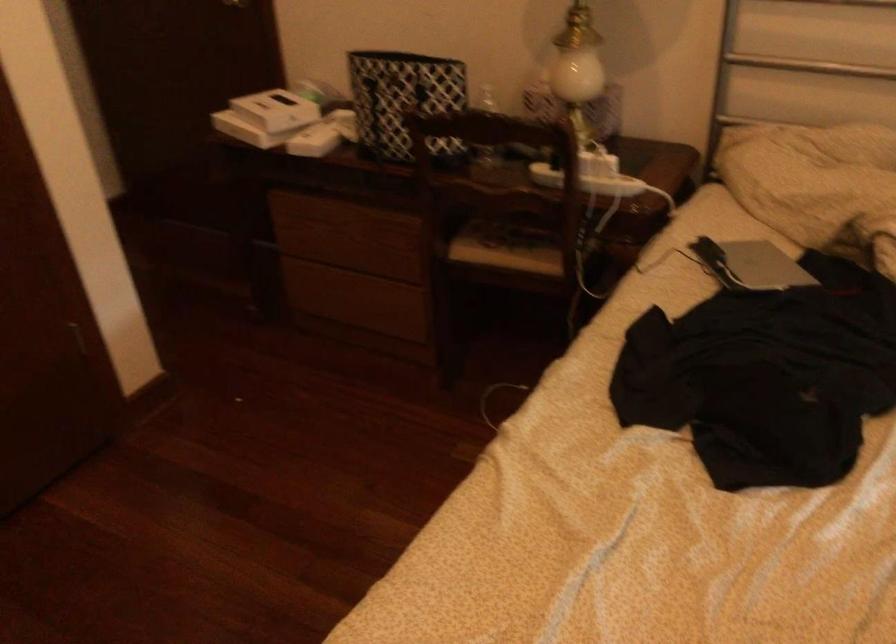
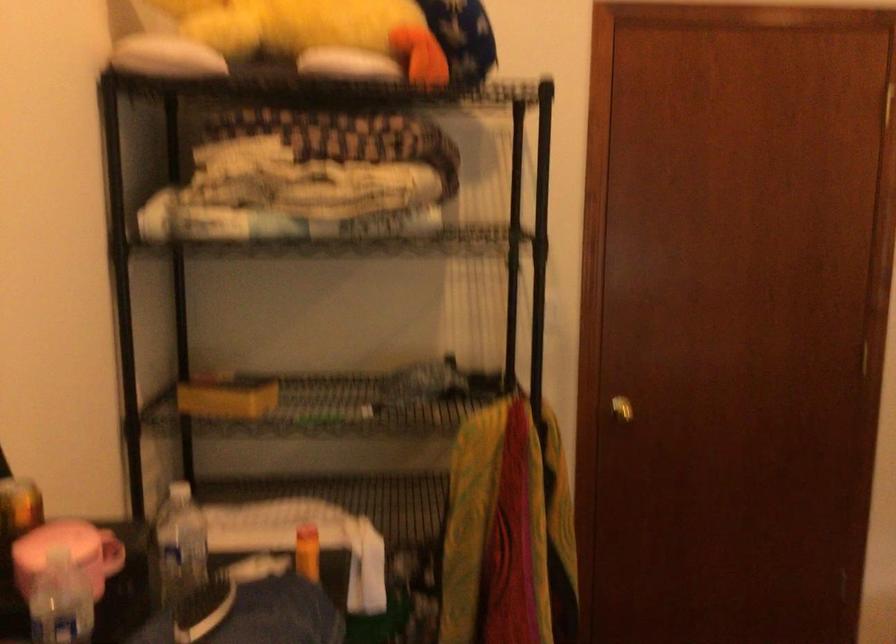
Question: The camera is either moving clockwise (left) or counter-clockwise (right) around the object. The first image is from the beginning of the video and the second image is from the end. Is the camera moving left or right when shooting the video?

Choices:
 (A) Left
 (B) Right

Answer: (B)